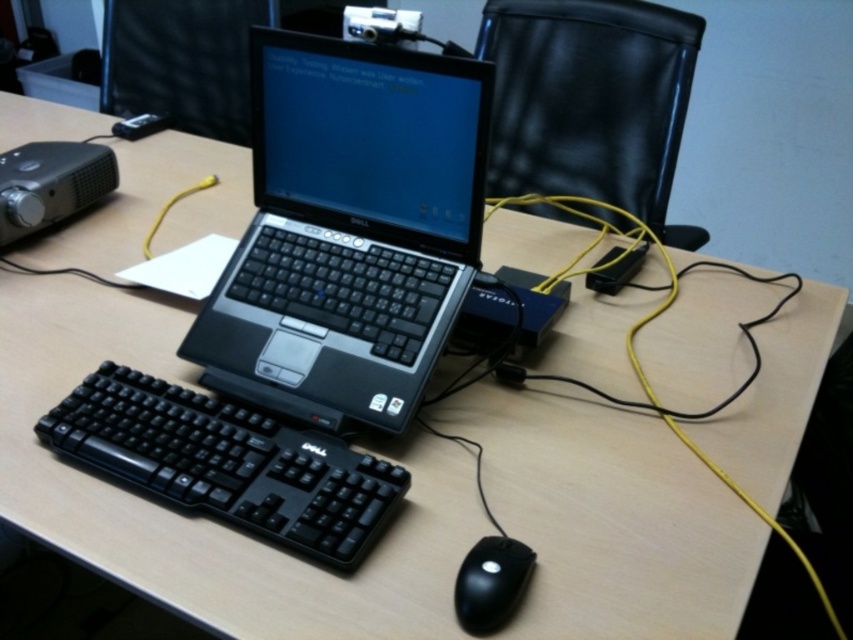
Which is above, black plastic laptop at center or black plastic projector at left?

black plastic projector at left is higher up.

Identify the location of black plastic laptop at center. (347, 230).

Is point (430, 346) positioned before point (61, 208)?

Yes, it is in front of point (61, 208).

At what (x,y) coordinates should I click in order to perform the action: click on black plastic laptop at center. Please return your answer as a coordinate pair (x, y). The image size is (853, 640). Looking at the image, I should click on (347, 230).

Is black plastic laptop at center positioned in front of black leather chair at upper right?

Yes, it is in front of black leather chair at upper right.

Does point (312, 138) come closer to viewer compared to point (679, 109)?

Yes, it is.

The height and width of the screenshot is (640, 853). I want to click on black plastic laptop at center, so (347, 230).

Between black leather chair at upper right and black plastic keyboard at lower left, which one appears on the right side from the viewer's perspective?

From the viewer's perspective, black leather chair at upper right appears more on the right side.

Is point (669, 122) more distant than point (56, 429)?

Yes, it is.

What are the coordinates of `black leather chair at upper right` in the screenshot? It's located at (590, 100).